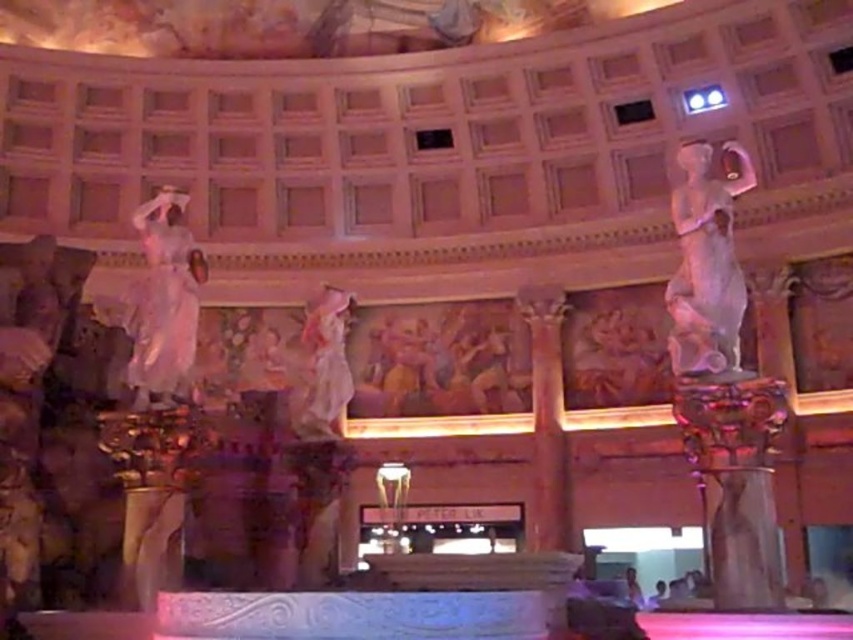
Which of these two, white marble statue at left or white marble statue at center, stands shorter?

white marble statue at center

Is white marble statue at left above white marble statue at center?

Correct, white marble statue at left is located above white marble statue at center.

Is point (171, 280) positioned in front of point (346, 308)?

Yes, point (171, 280) is closer to viewer.

Find the location of `white marble statue at left`. white marble statue at left is located at coordinates (163, 301).

Who is positioned more to the right, white marble statue at right or white marble statue at left?

From the viewer's perspective, white marble statue at right appears more on the right side.

Which of these two, white marble statue at right or white marble statue at left, stands shorter?

With less height is white marble statue at left.

Does point (709, 316) come farther from viewer compared to point (135, 209)?

No, it is not.

In order to click on white marble statue at right in this screenshot , I will do `click(706, 264)`.

Is white marble statue at right closer to the viewer compared to white marble statue at center?

Yes, it is in front of white marble statue at center.

From the picture: Can you confirm if white marble statue at right is thinner than white marble statue at center?

In fact, white marble statue at right might be wider than white marble statue at center.

Is point (706, 220) positioned in front of point (334, 292)?

Yes, point (706, 220) is closer to viewer.

Where is `white marble statue at right`? The width and height of the screenshot is (853, 640). white marble statue at right is located at coordinates (706, 264).